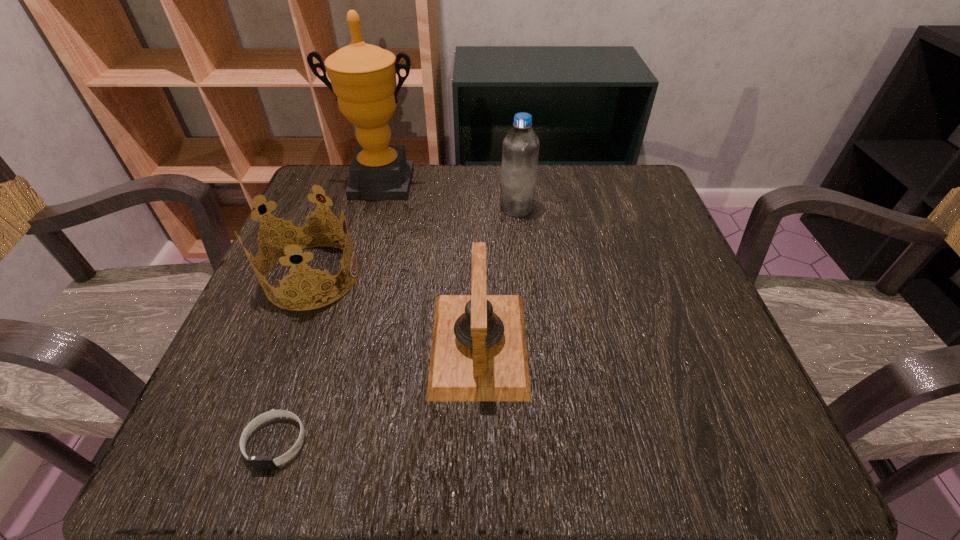
Identify the location of award present at the far edge. The height and width of the screenshot is (540, 960). (363, 77).

Find the location of a particular element. The width and height of the screenshot is (960, 540). water bottle located at the far edge is located at coordinates (520, 151).

Locate an element on the screen. The width and height of the screenshot is (960, 540). object that is at the near edge is located at coordinates (257, 462).

Where is `award situated at the left edge`? This screenshot has height=540, width=960. award situated at the left edge is located at coordinates point(363,77).

You are a GUI agent. You are given a task and a screenshot of the screen. Output one action in this format:
    pyautogui.click(x=<x>, y=<y>)
    Task: Click on the crown that is positioned at the left edge
    The height and width of the screenshot is (540, 960).
    Given the screenshot: What is the action you would take?
    pyautogui.click(x=296, y=237)

This screenshot has width=960, height=540. I want to click on wristband positioned at the left edge, so click(257, 462).

You are a GUI agent. You are given a task and a screenshot of the screen. Output one action in this format:
    pyautogui.click(x=<x>, y=<y>)
    Task: Click on the object present at the far left corner
    The height and width of the screenshot is (540, 960).
    Given the screenshot: What is the action you would take?
    pyautogui.click(x=363, y=77)

Image resolution: width=960 pixels, height=540 pixels. What are the coordinates of `object present at the near left corner` in the screenshot? It's located at (257, 462).

Find the location of a particular element. free location at the far edge is located at coordinates (563, 208).

The width and height of the screenshot is (960, 540). Find the location of `free space at the near edge of the desktop`. free space at the near edge of the desktop is located at coordinates (375, 468).